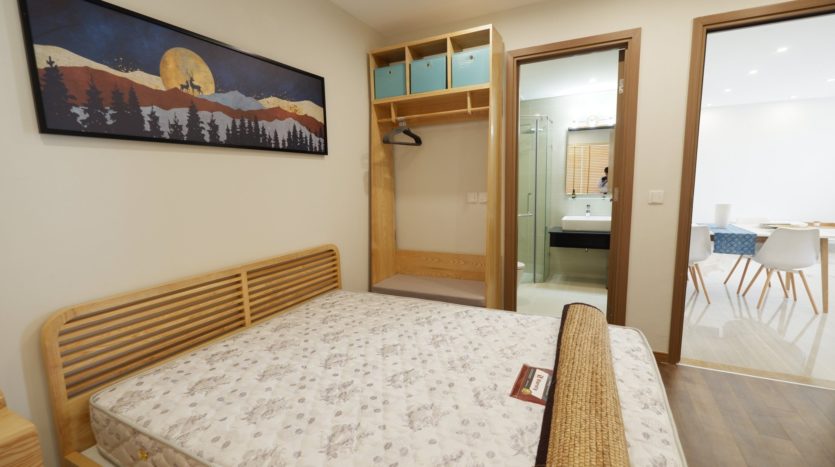
Locate an element on the screen. This screenshot has height=467, width=835. clothes hangers is located at coordinates (386, 141).